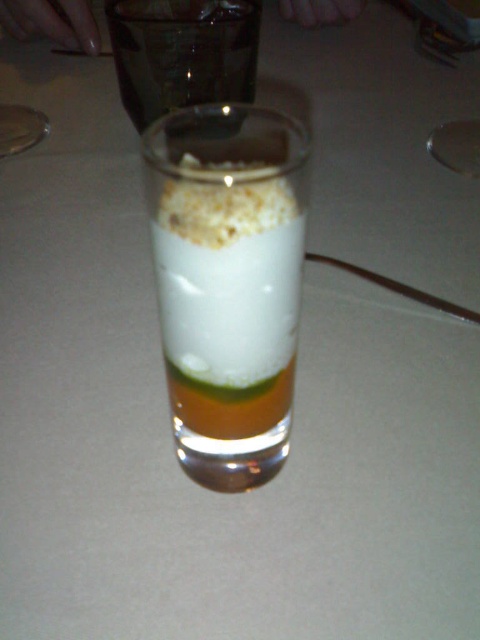
Question: Does translucent glass dessert at center lie in front of white crumbly topping at center?

Choices:
 (A) no
 (B) yes

Answer: (B)

Question: Which of these objects is positioned farthest from the white crumbly topping at center?

Choices:
 (A) translucent glass dessert at center
 (B) white creamy milk at center

Answer: (A)

Question: Which point is farther to the camera?

Choices:
 (A) (251, 204)
 (B) (233, 372)
 (C) (218, 253)

Answer: (B)

Question: Is white creamy milk at center smaller than white crumbly topping at center?

Choices:
 (A) no
 (B) yes

Answer: (A)

Question: Can you confirm if white creamy milk at center is wider than transparent glass at upper center?

Choices:
 (A) no
 (B) yes

Answer: (A)

Question: Which of the following is the farthest from the observer?

Choices:
 (A) (191, 368)
 (B) (204, 60)
 (C) (280, 260)
 (D) (279, 192)

Answer: (B)